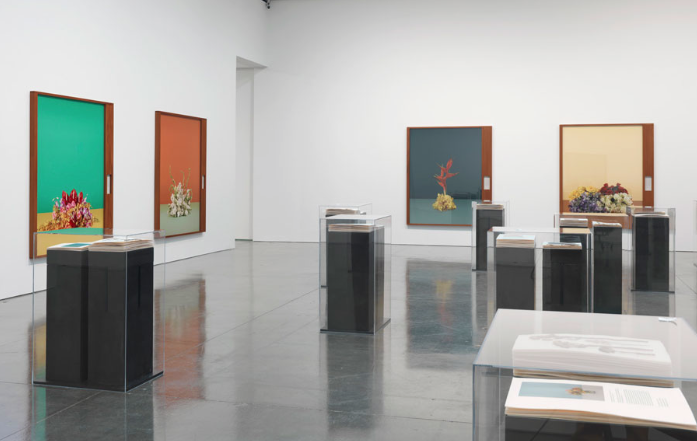
Locate an element on the screen. frame is located at coordinates (x=158, y=170).